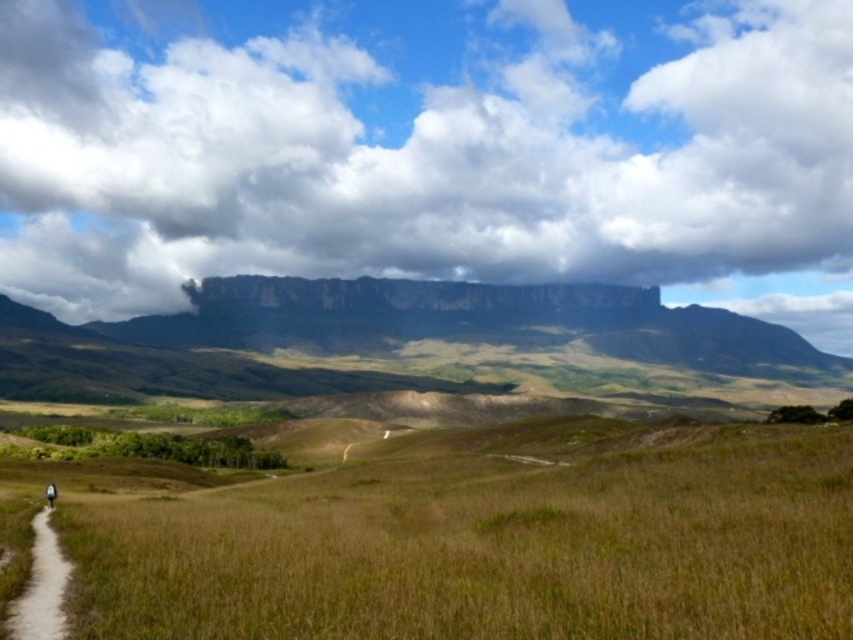
Question: Which object appears farthest from the camera in this image?

Choices:
 (A) cloudy sky at upper center
 (B) brown dirt path at lower left

Answer: (A)

Question: Which object appears closest to the camera in this image?

Choices:
 (A) brown dry grass at lower center
 (B) cloudy sky at upper center
 (C) brown dirt path at lower left

Answer: (A)

Question: Observing the image, what is the correct spatial positioning of cloudy sky at upper center in reference to brown dry grass at lower center?

Choices:
 (A) right
 (B) left

Answer: (A)

Question: Observing the image, what is the correct spatial positioning of cloudy sky at upper center in reference to brown dirt path at lower left?

Choices:
 (A) above
 (B) below

Answer: (A)

Question: Can you confirm if cloudy sky at upper center is bigger than brown dry grass at lower center?

Choices:
 (A) yes
 (B) no

Answer: (A)

Question: Which of the following is the farthest from the observer?

Choices:
 (A) brown dirt path at lower left
 (B) brown dry grass at lower center

Answer: (A)